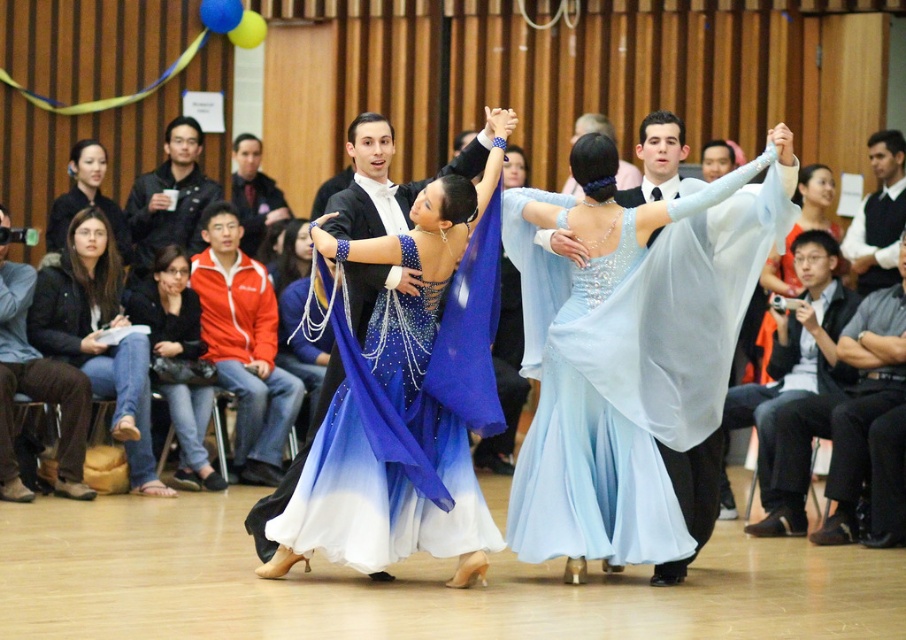
Is point (76, 308) farther from camera compared to point (278, 326)?

No, it is in front of (278, 326).

In the scene shown: Which is above, brown leather purse at lower left or shiny blue dress at center?

Positioned higher is shiny blue dress at center.

Who is more forward, (53, 285) or (313, 397)?

Positioned in front is point (53, 285).

Image resolution: width=906 pixels, height=640 pixels. I want to click on brown leather purse at lower left, so click(x=98, y=337).

Does black leather pants at lower right have a lesser width compared to shiny blue dress at center?

Incorrect, black leather pants at lower right's width is not less than shiny blue dress at center's.

At what (x,y) coordinates should I click in order to perform the action: click on black leather pants at lower right. Please return your answer as a coordinate pair (x, y). Looking at the image, I should click on (863, 400).

Find the location of `black leather pants at lower right`. black leather pants at lower right is located at coordinates (863, 400).

Can you confirm if blue satin dress at center is positioned above black leather jacket at lower left?

No, blue satin dress at center is not above black leather jacket at lower left.

The height and width of the screenshot is (640, 906). What do you see at coordinates (403, 428) in the screenshot? I see `blue satin dress at center` at bounding box center [403, 428].

Locate an element on the screen. This screenshot has width=906, height=640. blue satin dress at center is located at coordinates (403, 428).